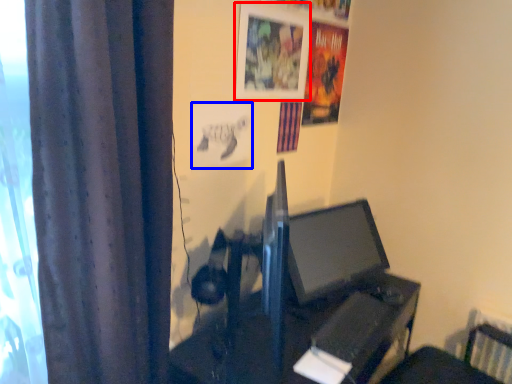
Question: Which object appears closest to the camera in this image, picture frame (highlighted by a red box) or poster page (highlighted by a blue box)?

Choices:
 (A) picture frame
 (B) poster page

Answer: (B)